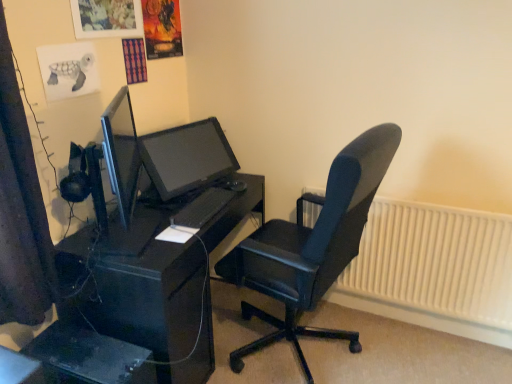
Locate an element on the screen. This screenshot has height=384, width=512. blank space above black glossy desk at center (from a real-world perspective) is located at coordinates (183, 206).